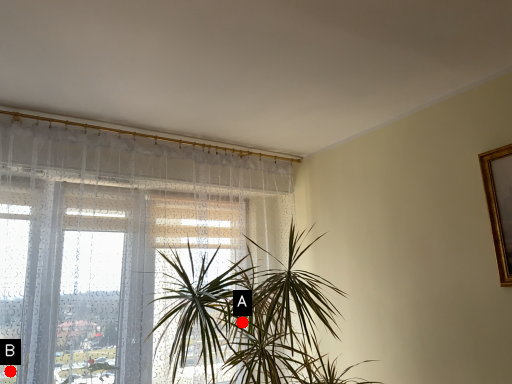
Question: Two points are circled on the image, labeled by A and B beside each circle. Which point is farther to the camera?

Choices:
 (A) A is further
 (B) B is further

Answer: (A)